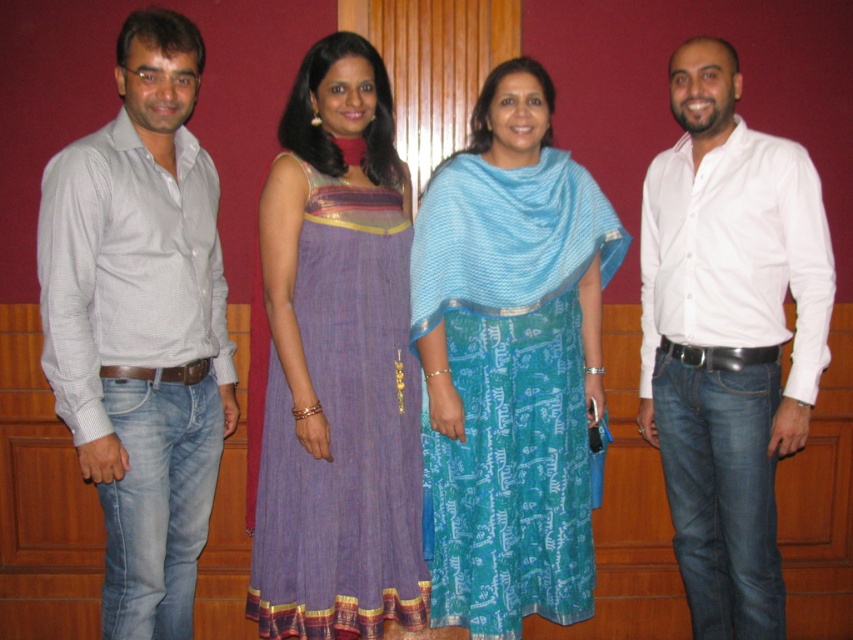
Question: Can you confirm if white cotton shirt at right is positioned above purple cotton dress at center?

Choices:
 (A) yes
 (B) no

Answer: (A)

Question: Can you confirm if blue printed dress at center is smaller than blue silk shawl at center?

Choices:
 (A) yes
 (B) no

Answer: (B)

Question: Which point is farther to the camera?

Choices:
 (A) [x=231, y=346]
 (B) [x=473, y=221]
 (C) [x=450, y=236]
 (D) [x=329, y=422]

Answer: (A)

Question: Which point appears closest to the camera in this image?

Choices:
 (A) (546, 403)
 (B) (711, 429)
 (C) (286, 556)

Answer: (C)

Question: Is white cotton shirt at right wider than purple cotton dress at center?

Choices:
 (A) yes
 (B) no

Answer: (B)

Question: Which point is closer to the camera?

Choices:
 (A) light gray shirt at left
 (B) blue printed dress at center
 (C) purple cotton dress at center
 (D) white cotton shirt at right

Answer: (A)